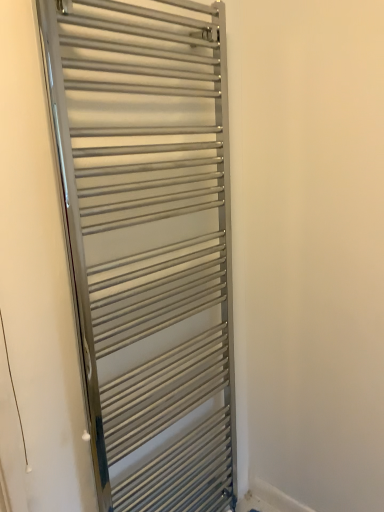
Locate an element on the screen. The width and height of the screenshot is (384, 512). polished metal towel rack at center is located at coordinates (148, 243).

This screenshot has width=384, height=512. What do you see at coordinates (148, 243) in the screenshot? I see `polished metal towel rack at center` at bounding box center [148, 243].

This screenshot has height=512, width=384. What are the coordinates of `polished metal towel rack at center` in the screenshot? It's located at (148, 243).